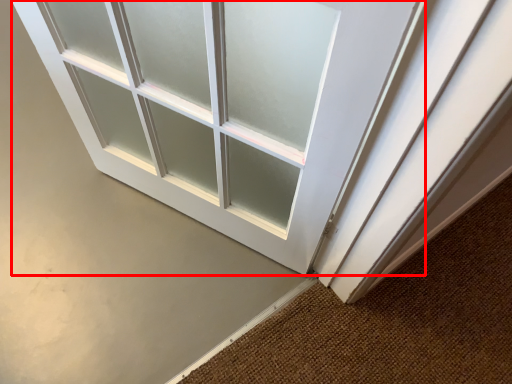
Question: Where is door (annotated by the red box) located in relation to doormat in the image?

Choices:
 (A) left
 (B) right

Answer: (A)